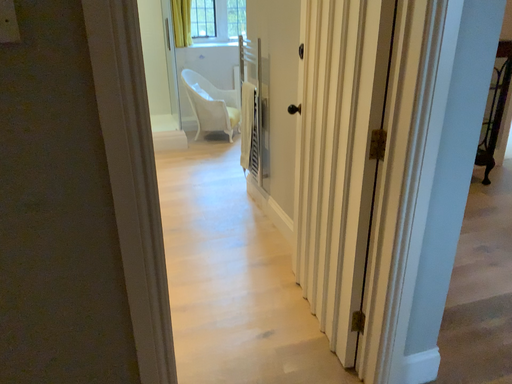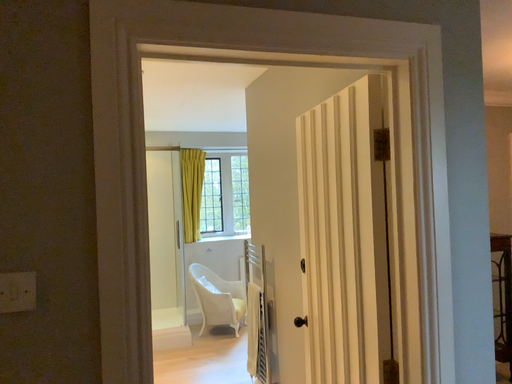
Question: How did the camera likely rotate when shooting the video?

Choices:
 (A) rotated downward
 (B) rotated upward

Answer: (B)